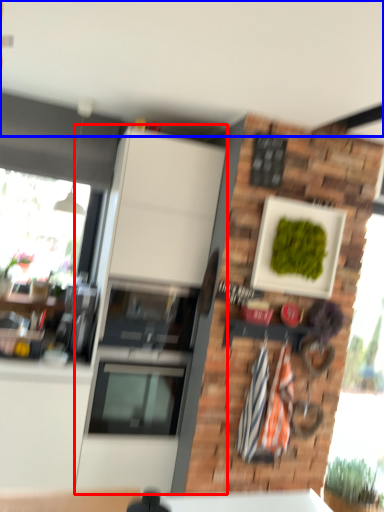
Question: Which point is further to the camera, cabinetry (highlighted by a red box) or backdrop (highlighted by a blue box)?

Choices:
 (A) cabinetry
 (B) backdrop

Answer: (A)